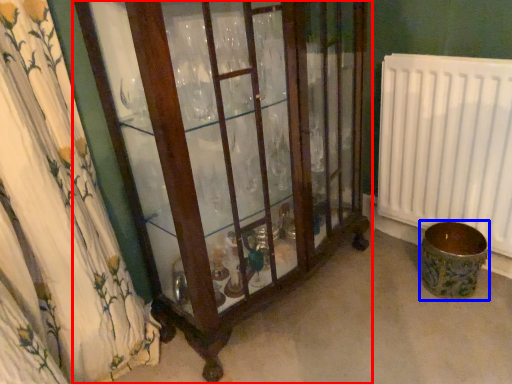
Question: Which point is closer to the camera, furniture (highlighted by a red box) or toilet bowl (highlighted by a blue box)?

Choices:
 (A) furniture
 (B) toilet bowl

Answer: (A)